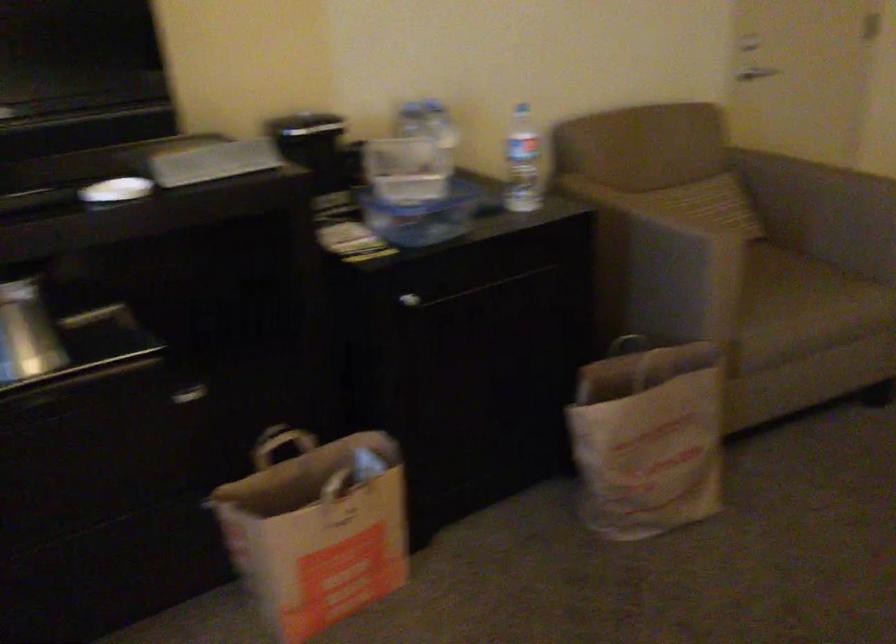
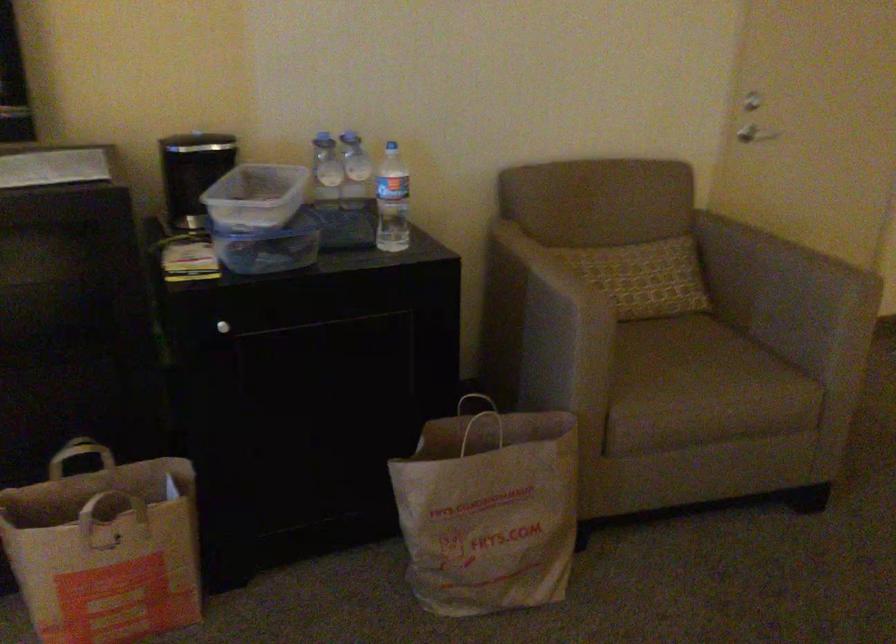
The point at (669, 220) is marked in the first image. Where is the corresponding point in the second image?

(552, 281)